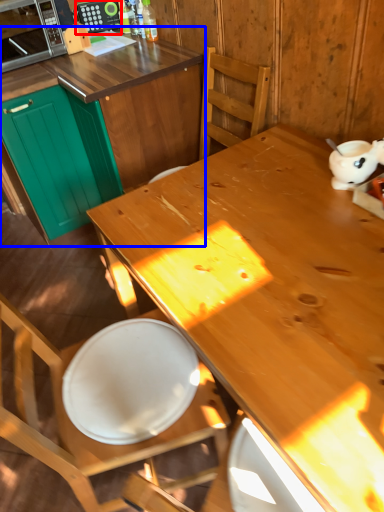
Question: Which object appears farthest to the camera in this image, appliance (highlighted by a red box) or cabinetry (highlighted by a blue box)?

Choices:
 (A) appliance
 (B) cabinetry

Answer: (A)